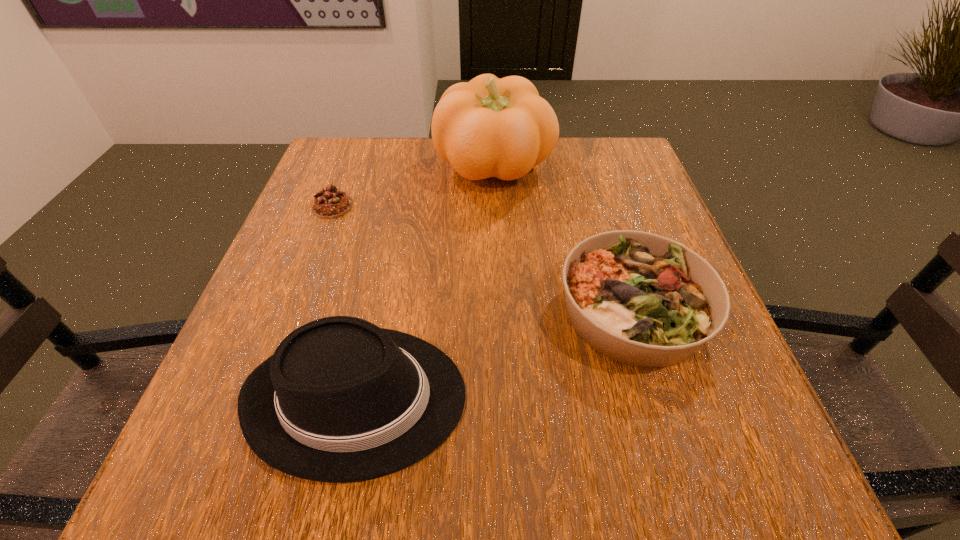
The width and height of the screenshot is (960, 540). I want to click on free point between the pumpkin and the salad plate, so coord(564,238).

Find the location of a particular element. The height and width of the screenshot is (540, 960). free spot between the third shortest object and the second shortest object is located at coordinates (495, 354).

You are a GUI agent. You are given a task and a screenshot of the screen. Output one action in this format:
    pyautogui.click(x=<x>, y=<y>)
    Task: Click on the vacant area between the fedora and the chocolate cake
    
    Given the screenshot: What is the action you would take?
    pyautogui.click(x=345, y=302)

Find the location of a particular element. vacant space in between the third shortest object and the third tallest object is located at coordinates (495, 354).

This screenshot has height=540, width=960. I want to click on free area in between the chocolate cake and the pumpkin, so click(x=414, y=186).

Where is `vacant space in between the second tallest object and the salad plate`? The height and width of the screenshot is (540, 960). vacant space in between the second tallest object and the salad plate is located at coordinates (495, 354).

I want to click on blank region between the second tallest object and the salad plate, so click(495, 354).

Where is `vacant space that's between the second tallest object and the chocolate cake`? The height and width of the screenshot is (540, 960). vacant space that's between the second tallest object and the chocolate cake is located at coordinates (345, 302).

Find the location of a particular element. vacant point located between the second shortest object and the pumpkin is located at coordinates (564, 238).

Where is `free space between the shortest object and the salad plate`? free space between the shortest object and the salad plate is located at coordinates click(483, 258).